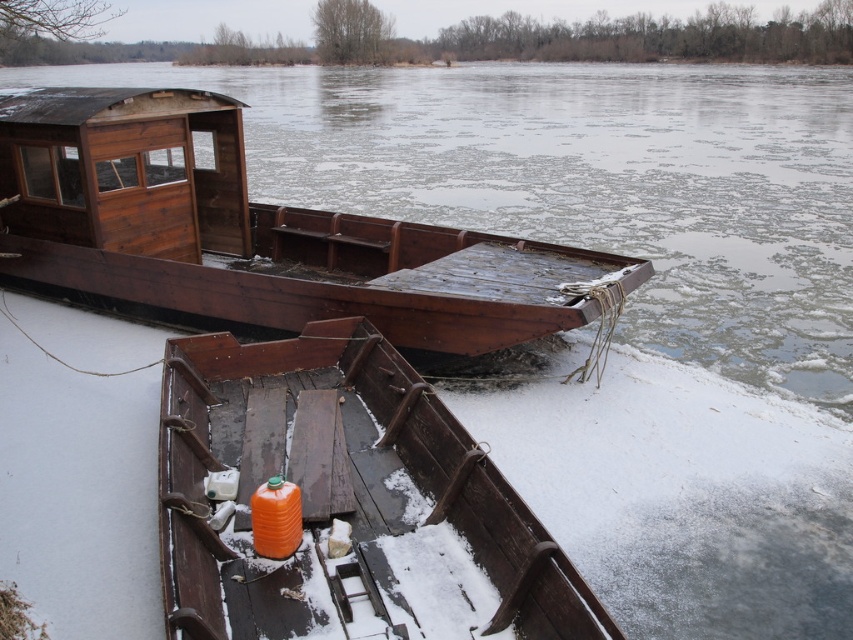
Question: Which of the following is the farthest from the observer?

Choices:
 (A) wooden boat at center
 (B) orange matte plastic container at center

Answer: (A)

Question: Is orange matte plastic container at center below wooden boat at center?

Choices:
 (A) yes
 (B) no

Answer: (A)

Question: Among these objects, which one is nearest to the camera?

Choices:
 (A) wooden boat at center
 (B) orange matte plastic container at center

Answer: (B)

Question: From the image, what is the correct spatial relationship of orange matte plastic container at center in relation to wooden boat at center?

Choices:
 (A) right
 (B) left

Answer: (A)

Question: Does orange matte plastic container at center have a lesser width compared to wooden boat at center?

Choices:
 (A) yes
 (B) no

Answer: (A)